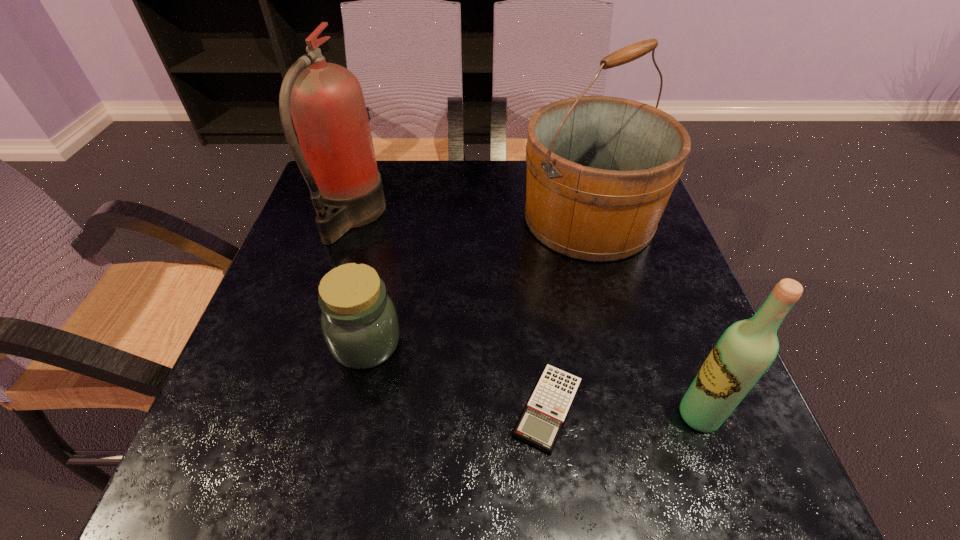
The width and height of the screenshot is (960, 540). I want to click on blank area located on the back of the fourth tallest object, so click(x=390, y=238).

Locate an element on the screen. vacant area located 0.140m on the back of the shortest object is located at coordinates (537, 308).

Locate an element on the screen. fire extinguisher present at the far edge is located at coordinates (337, 161).

I want to click on bucket that is at the far edge, so click(x=600, y=170).

Identify the location of object that is at the near edge. The image size is (960, 540). (x=540, y=424).

Where is `fire extinguisher located in the left edge section of the desktop`? The image size is (960, 540). fire extinguisher located in the left edge section of the desktop is located at coordinates click(337, 161).

This screenshot has width=960, height=540. What are the coordinates of `jar positioned at the left edge` in the screenshot? It's located at (359, 322).

This screenshot has width=960, height=540. What are the coordinates of `bucket situated at the right edge` in the screenshot? It's located at (600, 170).

You are a GUI agent. You are given a task and a screenshot of the screen. Output one action in this format:
    pyautogui.click(x=<x>, y=<y>)
    Task: Click on the wine bottle at the right edge
    The image size is (960, 540).
    Given the screenshot: What is the action you would take?
    (x=747, y=348)

Image resolution: width=960 pixels, height=540 pixels. Identify the location of object positioned at the far left corner. (337, 161).